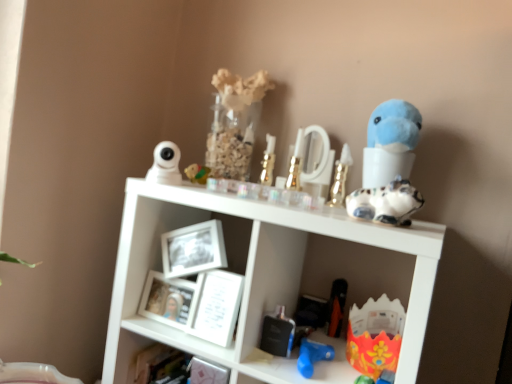
Question: Does metallic silver perfume bottle at lower center, which is counted as the 7th toy, starting from the right, have a greater width compared to speckled ceramic cat at upper right, the 9th toy from the left?

Choices:
 (A) no
 (B) yes

Answer: (A)

Question: Is metallic silver perfume bottle at lower center, which is the 4th toy in left-to-right order, at the right side of speckled ceramic cat at upper right, which appears as the second toy when viewed from the right?

Choices:
 (A) yes
 (B) no

Answer: (B)

Question: Is metallic silver perfume bottle at lower center, which is counted as the 7th toy, starting from the right, aimed at speckled ceramic cat at upper right, which appears as the second toy when viewed from the right?

Choices:
 (A) yes
 (B) no

Answer: (B)

Question: From the image's perspective, does metallic silver perfume bottle at lower center, which is the 4th toy in left-to-right order, appear lower than speckled ceramic cat at upper right, which appears as the second toy when viewed from the right?

Choices:
 (A) no
 (B) yes

Answer: (B)

Question: Does metallic silver perfume bottle at lower center, which is counted as the 7th toy, starting from the right, come behind speckled ceramic cat at upper right, which appears as the second toy when viewed from the right?

Choices:
 (A) no
 (B) yes

Answer: (B)

Question: Choose the correct answer: Is cardboard box at lower right, marked as the first toy in a right-to-left arrangement, inside speckled ceramic cat at upper right, the 9th toy from the left, or outside it?

Choices:
 (A) outside
 (B) inside

Answer: (A)

Question: Does point (371, 334) appear closer or farther from the camera than point (379, 200)?

Choices:
 (A) farther
 (B) closer

Answer: (A)

Question: From the image's perspective, is cardboard box at lower right, marked as the first toy in a right-to-left arrangement, positioned above or below speckled ceramic cat at upper right, the 9th toy from the left?

Choices:
 (A) below
 (B) above

Answer: (A)

Question: Is cardboard box at lower right, marked as the first toy in a right-to-left arrangement, bigger or smaller than speckled ceramic cat at upper right, which appears as the second toy when viewed from the right?

Choices:
 (A) small
 (B) big

Answer: (B)

Question: Considering the positions of black plastic toy at lower center, the 3th toy when ordered from right to left, and white plastic camera at upper left, which is counted as the 1th toy, starting from the left, in the image, is black plastic toy at lower center, the 3th toy when ordered from right to left, bigger or smaller than white plastic camera at upper left, which is counted as the 1th toy, starting from the left,?

Choices:
 (A) small
 (B) big

Answer: (A)

Question: Is black plastic toy at lower center, the 3th toy when ordered from right to left, in front of or behind white plastic camera at upper left, which is counted as the 1th toy, starting from the left, in the image?

Choices:
 (A) behind
 (B) front

Answer: (A)

Question: In terms of height, does black plastic toy at lower center, arranged as the eighth toy when viewed from the left, look taller or shorter compared to white plastic camera at upper left, which is counted as the 1th toy, starting from the left?

Choices:
 (A) short
 (B) tall

Answer: (B)

Question: Is black plastic toy at lower center, arranged as the eighth toy when viewed from the left, wider or thinner than white plastic camera at upper left, which is counted as the 1th toy, starting from the left?

Choices:
 (A) thin
 (B) wide

Answer: (A)

Question: Based on their sizes in the image, would you say matte yellow toy at upper center, the 9th toy in the right-to-left sequence, is bigger or smaller than white glossy picture frame at center, the 1th picture frame in the right-to-left sequence?

Choices:
 (A) small
 (B) big

Answer: (A)

Question: From the image's perspective, is matte yellow toy at upper center, the 9th toy in the right-to-left sequence, located above or below white glossy picture frame at center, the 1th picture frame in the right-to-left sequence?

Choices:
 (A) above
 (B) below

Answer: (A)